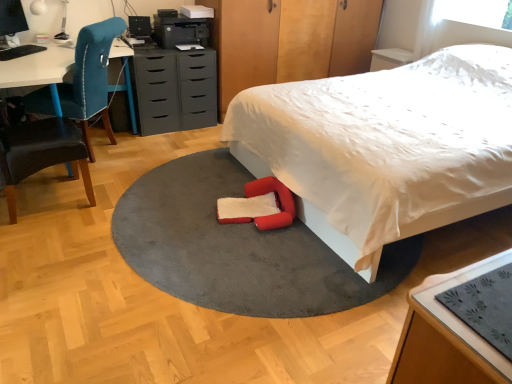
You are a GUI agent. You are given a task and a screenshot of the screen. Output one action in this format:
    pyautogui.click(x=<x>, y=<y>)
    Task: Click on the empty space that is to the right of velvet teal chair at left, the 1th chair viewed from the front
    This screenshot has height=384, width=512.
    Given the screenshot: What is the action you would take?
    [x=123, y=204]